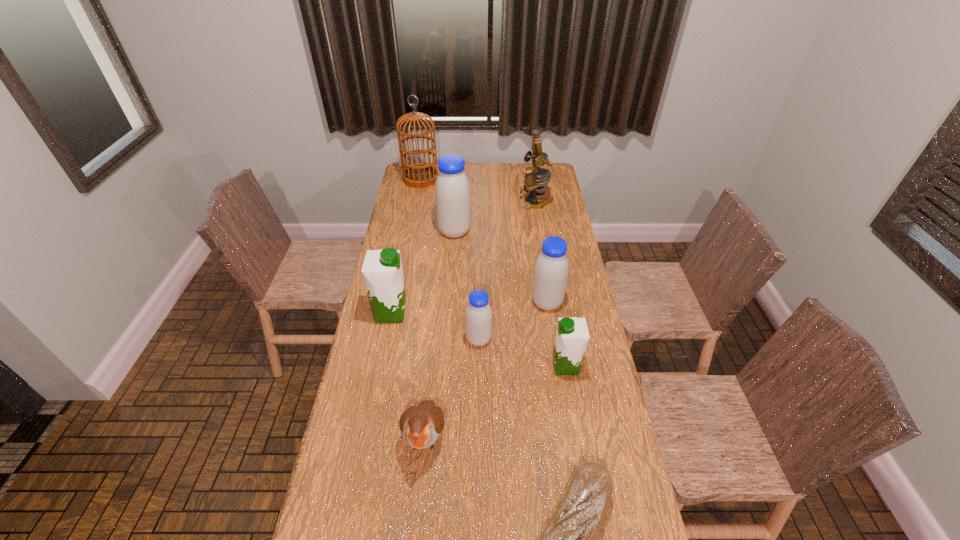
Where is `soya milk object that ranks as the fourth closest to the right green soya milk`? This screenshot has width=960, height=540. soya milk object that ranks as the fourth closest to the right green soya milk is located at coordinates (452, 189).

Where is `blue soya milk that is the second closest one to the bigger green soya milk`? Image resolution: width=960 pixels, height=540 pixels. blue soya milk that is the second closest one to the bigger green soya milk is located at coordinates (452, 189).

Where is `blue soya milk that stands as the second closest to the eighth tallest object`? blue soya milk that stands as the second closest to the eighth tallest object is located at coordinates (551, 270).

The image size is (960, 540). What are the coordinates of `free space that satisfies the following two spatial constraints: 1. on the back side of the tallest soya milk; 2. on the right side of the microscope` in the screenshot? It's located at (457, 202).

The width and height of the screenshot is (960, 540). I want to click on free spot that satisfies the following two spatial constraints: 1. on the front-facing side of the seventh farthest object; 2. at the face of the brown bird, so click(578, 436).

Where is `vacant region that satisfies the following two spatial constraints: 1. on the back side of the sixth farthest object; 2. on the front-facing side of the farther green soya milk`? This screenshot has width=960, height=540. vacant region that satisfies the following two spatial constraints: 1. on the back side of the sixth farthest object; 2. on the front-facing side of the farther green soya milk is located at coordinates (479, 313).